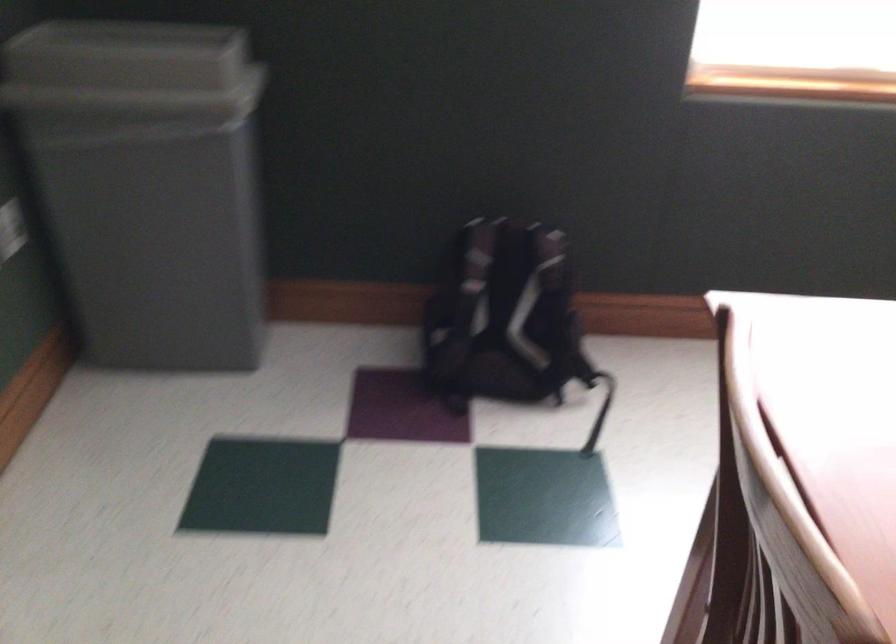
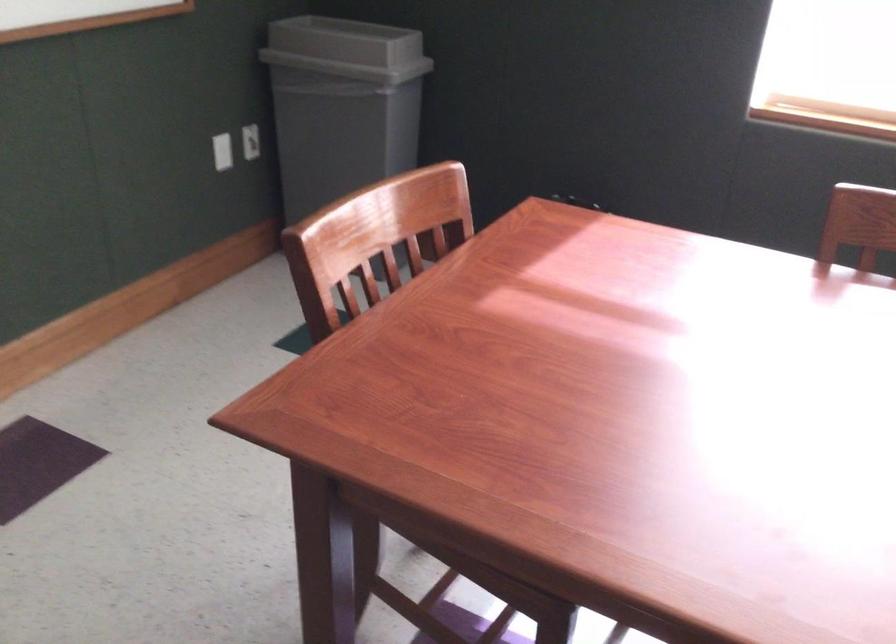
The point at (166,70) is marked in the first image. Where is the corresponding point in the second image?

(346, 49)